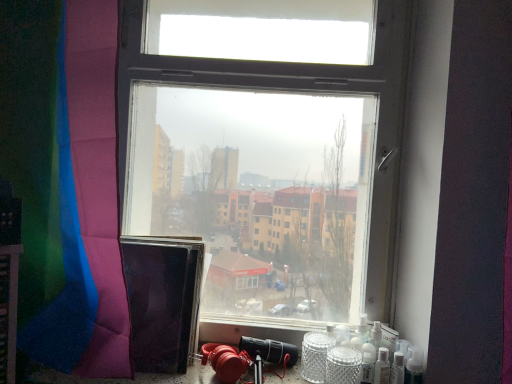
Question: Is clear glass jar at lower right, the first glass jar when ordered from left to right, closer to the viewer compared to silver textured glass jar at lower right, which ranks as the 1th glass jar in right-to-left order?

Choices:
 (A) no
 (B) yes

Answer: (A)

Question: Are clear glass jar at lower right, the first glass jar when ordered from left to right, and silver textured glass jar at lower right, which ranks as the 1th glass jar in right-to-left order, beside each other?

Choices:
 (A) no
 (B) yes

Answer: (B)

Question: Can we say clear glass jar at lower right, the second glass jar in the right-to-left sequence, lies outside silver textured glass jar at lower right, which ranks as the 1th glass jar in right-to-left order?

Choices:
 (A) yes
 (B) no

Answer: (A)

Question: From the image's perspective, does clear glass jar at lower right, the second glass jar in the right-to-left sequence, appear higher than silver textured glass jar at lower right, positioned as the 2th glass jar in left-to-right order?

Choices:
 (A) no
 (B) yes

Answer: (B)

Question: Does clear glass jar at lower right, the first glass jar when ordered from left to right, have a lesser height compared to silver textured glass jar at lower right, positioned as the 2th glass jar in left-to-right order?

Choices:
 (A) no
 (B) yes

Answer: (A)

Question: Considering their positions, is clear glass wine bottle at lower right located in front of or behind clear glass jar at lower right, the second glass jar in the right-to-left sequence?

Choices:
 (A) front
 (B) behind

Answer: (B)

Question: From the image's perspective, is clear glass wine bottle at lower right above or below clear glass jar at lower right, the second glass jar in the right-to-left sequence?

Choices:
 (A) below
 (B) above

Answer: (A)

Question: Considering the positions of point (387, 372) and point (327, 342), is point (387, 372) closer or farther from the camera than point (327, 342)?

Choices:
 (A) farther
 (B) closer

Answer: (B)

Question: From a real-world perspective, relative to clear glass jar at lower right, the first glass jar when ordered from left to right, is clear glass wine bottle at lower right vertically above or below?

Choices:
 (A) below
 (B) above

Answer: (A)

Question: Relative to silver textured glass jar at lower right, positioned as the 2th glass jar in left-to-right order, is clear glass jar at lower right, the second glass jar in the right-to-left sequence, in front or behind?

Choices:
 (A) front
 (B) behind

Answer: (B)

Question: From the image's perspective, relative to silver textured glass jar at lower right, which ranks as the 1th glass jar in right-to-left order, is clear glass jar at lower right, the second glass jar in the right-to-left sequence, above or below?

Choices:
 (A) below
 (B) above

Answer: (B)

Question: Does point (322, 377) appear closer or farther from the camera than point (358, 354)?

Choices:
 (A) closer
 (B) farther

Answer: (B)

Question: Considering the positions of clear glass jar at lower right, the first glass jar when ordered from left to right, and silver textured glass jar at lower right, which ranks as the 1th glass jar in right-to-left order, in the image, is clear glass jar at lower right, the first glass jar when ordered from left to right, bigger or smaller than silver textured glass jar at lower right, which ranks as the 1th glass jar in right-to-left order,?

Choices:
 (A) small
 (B) big

Answer: (B)

Question: Is point (74, 352) positioned closer to the camera than point (157, 122)?

Choices:
 (A) closer
 (B) farther

Answer: (A)

Question: Is shiny polyester curtain at left taller or shorter than transparent glass window at center?

Choices:
 (A) tall
 (B) short

Answer: (B)